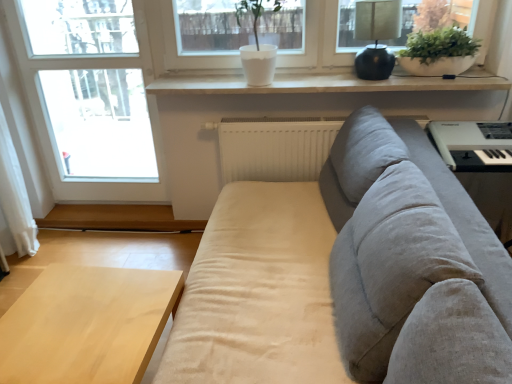
Question: Would you say white matte window sill at upper center is a long distance from transparent glass window at left?

Choices:
 (A) yes
 (B) no

Answer: (B)

Question: Does white matte window sill at upper center come in front of transparent glass window at left?

Choices:
 (A) no
 (B) yes

Answer: (B)

Question: From a real-world perspective, is white matte window sill at upper center located beneath transparent glass window at left?

Choices:
 (A) no
 (B) yes

Answer: (A)

Question: Is white matte window sill at upper center at the right side of transparent glass window at left?

Choices:
 (A) yes
 (B) no

Answer: (A)

Question: From the image's perspective, is white matte window sill at upper center located beneath transparent glass window at left?

Choices:
 (A) yes
 (B) no

Answer: (B)

Question: In the image, is matte black lamp at upper right positioned in front of or behind white matte radiator at center?

Choices:
 (A) behind
 (B) front

Answer: (B)

Question: Is matte black lamp at upper right wider or thinner than white matte radiator at center?

Choices:
 (A) wide
 (B) thin

Answer: (A)

Question: From a real-world perspective, is matte black lamp at upper right above or below white matte radiator at center?

Choices:
 (A) below
 (B) above

Answer: (B)

Question: Do you think matte black lamp at upper right is within white matte radiator at center, or outside of it?

Choices:
 (A) outside
 (B) inside

Answer: (A)

Question: From a real-world perspective, is white matte bowl at upper right positioned above or below matte black lamp at upper right?

Choices:
 (A) above
 (B) below

Answer: (B)

Question: Is white matte bowl at upper right to the left or to the right of matte black lamp at upper right in the image?

Choices:
 (A) left
 (B) right

Answer: (B)

Question: Relative to matte black lamp at upper right, is white matte bowl at upper right in front or behind?

Choices:
 (A) front
 (B) behind

Answer: (B)

Question: Is white matte bowl at upper right situated inside matte black lamp at upper right or outside?

Choices:
 (A) inside
 (B) outside

Answer: (B)

Question: From the image's perspective, is matte black lamp at upper right above or below white matte bowl at upper right?

Choices:
 (A) above
 (B) below

Answer: (A)

Question: Relative to white matte bowl at upper right, is matte black lamp at upper right in front or behind?

Choices:
 (A) front
 (B) behind

Answer: (A)